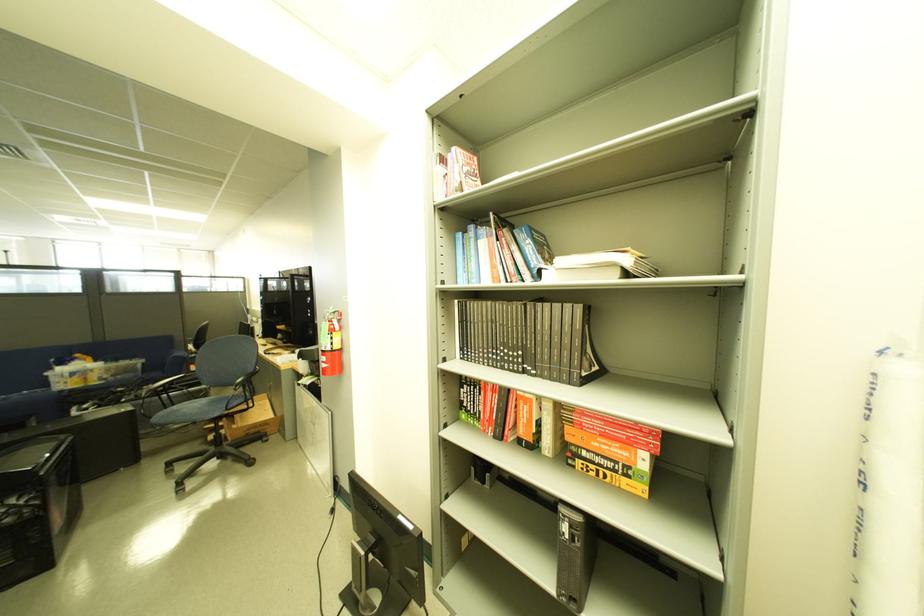
Where is `red paperback book`? red paperback book is located at coordinates (613, 429).